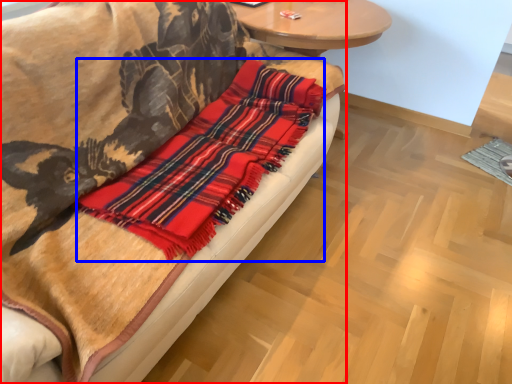
Question: Which point is further to the camera, studio couch (highlighted by a red box) or flannel (highlighted by a blue box)?

Choices:
 (A) studio couch
 (B) flannel

Answer: (B)